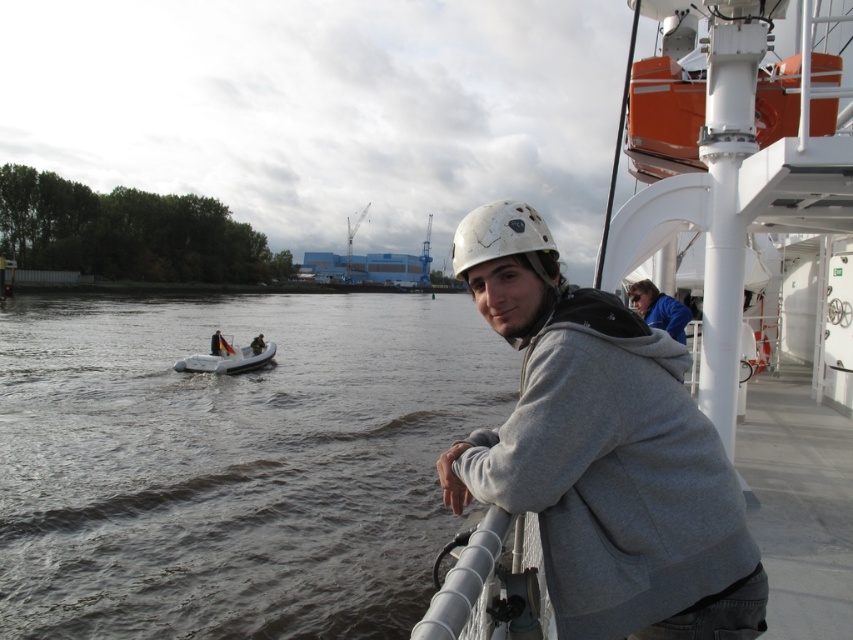
Looking at this image, you are standing on the deck of a ship and want to take a photo of the point at coordinates point (350, 513). The camera you have can focus on objects up to 40 feet away. Will the point be in focus?

The distance of point (350, 513) from camera is 35.33 feet, which is within the camera focus range of up to 40 feet. The point will be in focus.